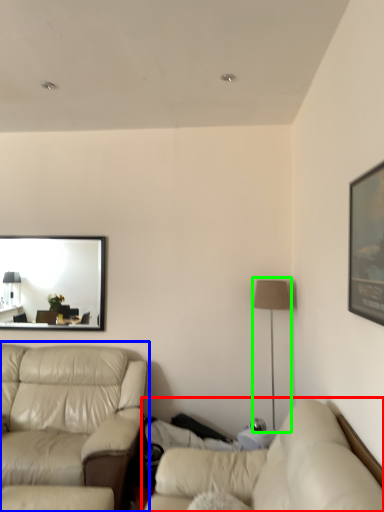
Question: Which is farther away from studio couch (highlighted by a red box)? studio couch (highlighted by a blue box) or table lamp (highlighted by a green box)?

Choices:
 (A) studio couch
 (B) table lamp

Answer: (B)